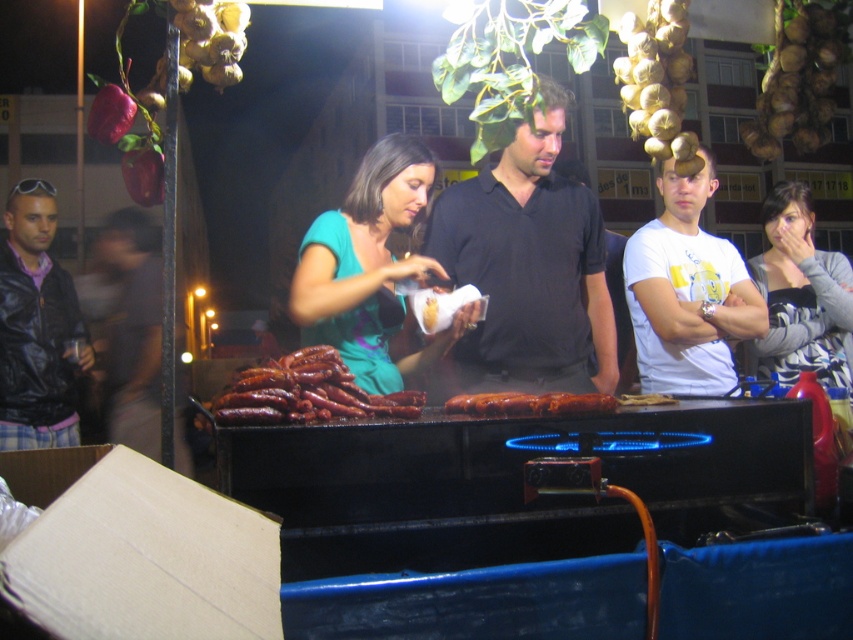
Question: Which point is farther to the camera?

Choices:
 (A) green matte shirt at center
 (B) striped fabric shirt at right
 (C) golden brown garlic at upper right

Answer: (B)

Question: Is striped fabric shirt at right above golden brown garlic at upper right?

Choices:
 (A) yes
 (B) no

Answer: (B)

Question: Can you confirm if brown glossy sausages at center is positioned to the left of golden brown garlic at upper right?

Choices:
 (A) no
 (B) yes

Answer: (B)

Question: Which point is farther to the camera?

Choices:
 (A) brown glossy sausages at center
 (B) striped fabric shirt at right
 (C) golden brown garlic at upper right

Answer: (B)

Question: Does black leather jacket at left appear on the right side of golden brown onion at upper right?

Choices:
 (A) yes
 (B) no

Answer: (B)

Question: Which object appears closest to the camera in this image?

Choices:
 (A) brown glossy sausages at center
 (B) green matte shirt at center
 (C) golden brown garlic at upper right
 (D) golden brown onion at upper right

Answer: (A)